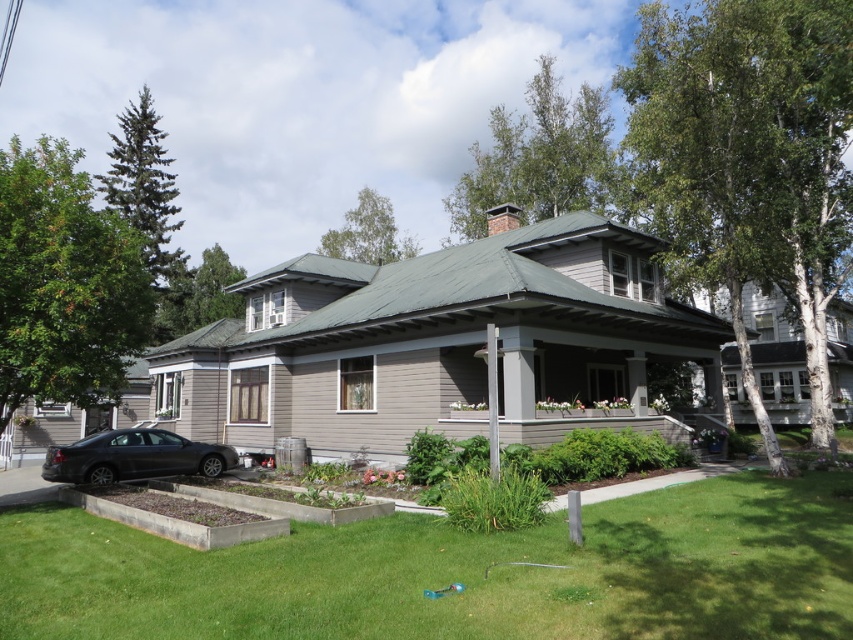
You are standing at the front porch of the two story house with white columns. You see a point marked at coordinate (457, 572). What is the color of the surface where this point is located?

The point at coordinate (457, 572) is located on green grass at lower center, so the surface color is green.

You are standing at the front porch of the house and want to walk to the small blue object near the garden bed. Which direction should you head relative to the point labeled as point (846, 564) and point (80, 472)?

You should head towards point (80, 472) because it is behind point (846, 564), meaning the small blue object is located in that direction.

You are standing in front of the house and notice the green grass at lower center and the matte black car at lower left. Which object is positioned to the right of the other?

The green grass at lower center is to the right of the matte black car at lower left.